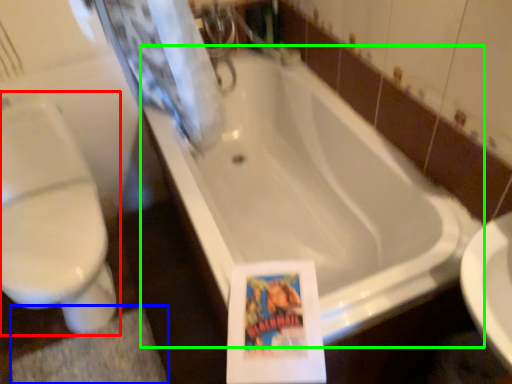
Question: Estimate the real-world distances between objects in this image. Which object is farther from toilet (highlighted by a red box), bath mat (highlighted by a blue box) or bathtub (highlighted by a green box)?

Choices:
 (A) bath mat
 (B) bathtub

Answer: (B)